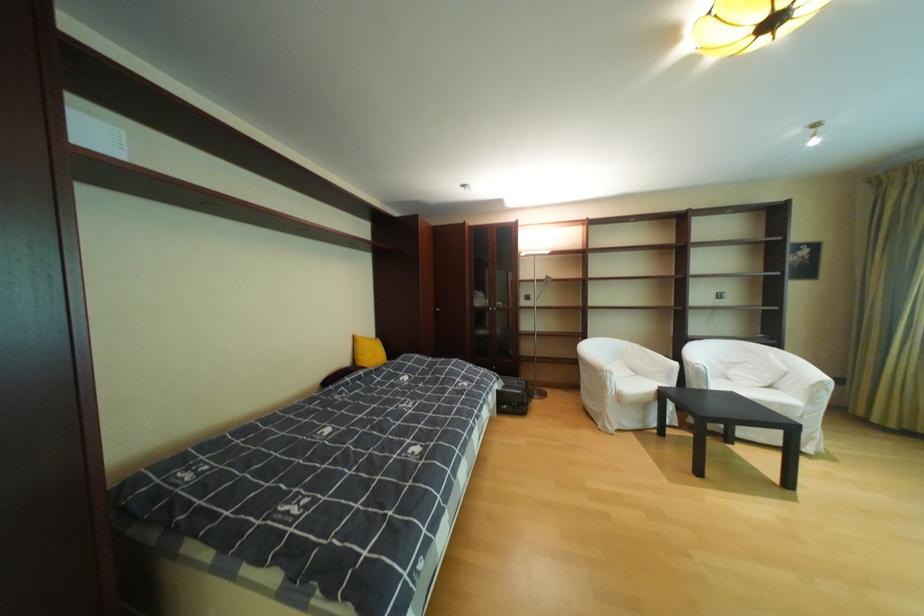
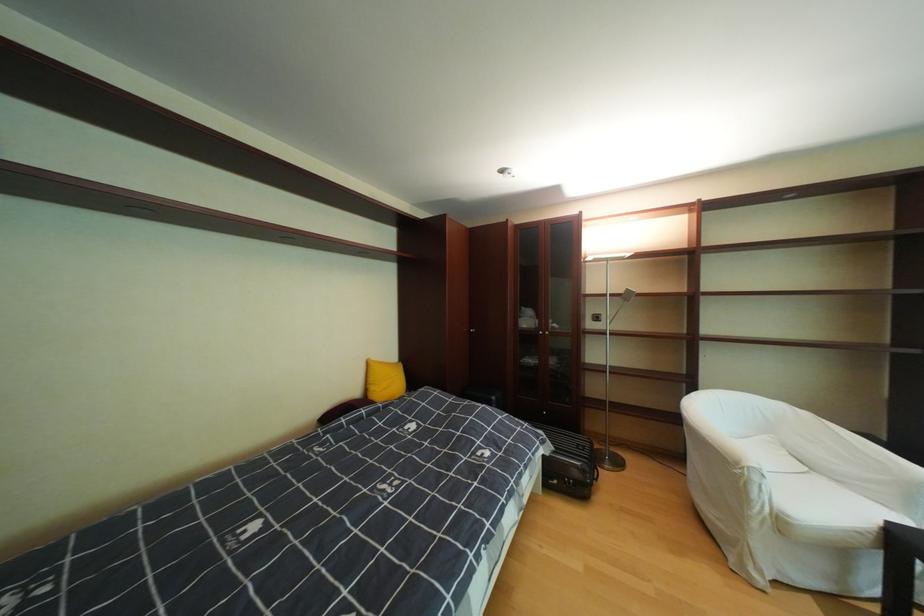
Question: I am providing you with two images of the same scene from different viewpoints. Please identify which objects are invisible in image2.

Choices:
 (A) silver cabinet handle
 (B) white sofa sitting surface
 (C) black wall switch
 (D) none of these

Answer: (D)